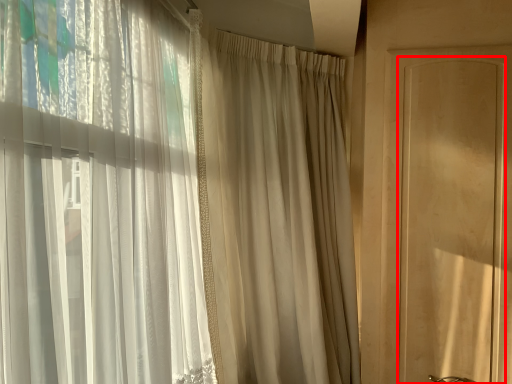
Question: From the image's perspective, what is the correct spatial relationship of screen door (annotated by the red box) in relation to curtain?

Choices:
 (A) below
 (B) above

Answer: (B)